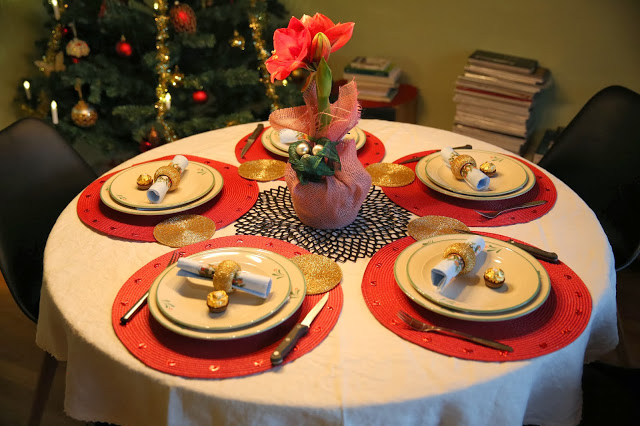
What are the coordinates of `round brown napkin holders` in the screenshot? It's located at (225, 271), (463, 248), (459, 161), (168, 170).